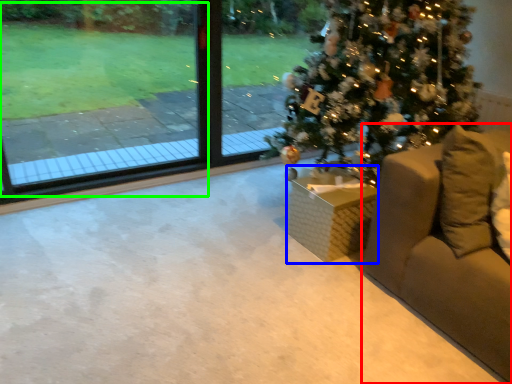
Question: Which is nearer to the furniture (highlighted by a red box)? furniture (highlighted by a blue box) or window screen (highlighted by a green box).

Choices:
 (A) furniture
 (B) window screen

Answer: (A)